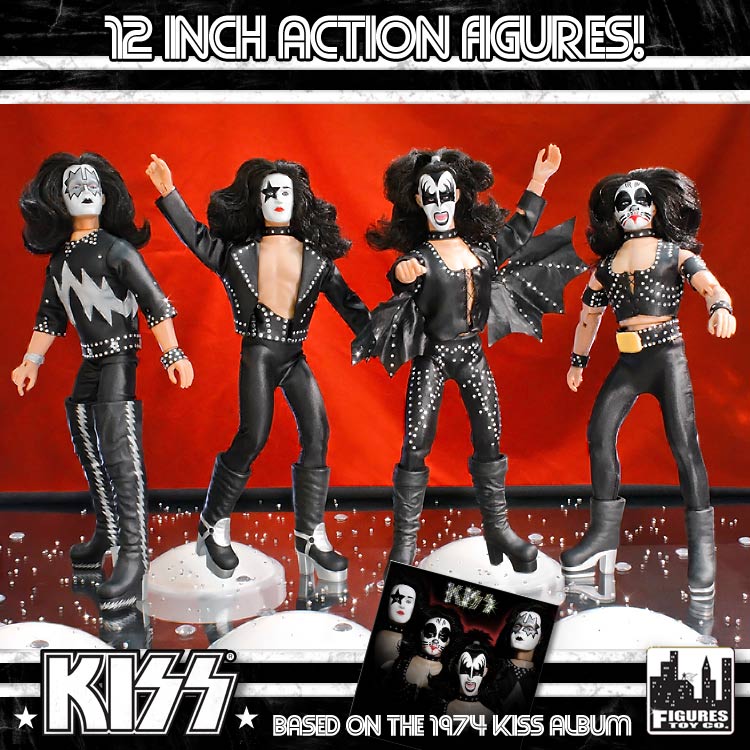
Find the location of a particular element. The width and height of the screenshot is (750, 750). white bar is located at coordinates (681, 58), (669, 99), (606, 664), (614, 693).